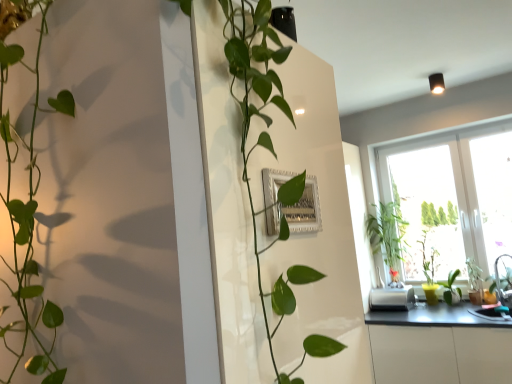
The image size is (512, 384). What do you see at coordinates (452, 196) in the screenshot? I see `transparent glass window at right` at bounding box center [452, 196].

Describe the element at coordinates (392, 299) in the screenshot. I see `white plastic toaster at lower right` at that location.

What do you see at coordinates (298, 212) in the screenshot?
I see `silver/glossy picture frame at center` at bounding box center [298, 212].

This screenshot has width=512, height=384. Describe the element at coordinates (498, 291) in the screenshot. I see `matte black sink at lower right` at that location.

I want to click on green glossy plant at right, arranged as the 2th houseplant when viewed from the front, so click(387, 236).

What do you see at coordinates (451, 288) in the screenshot? The height and width of the screenshot is (384, 512). I see `green glossy plant at right, the 2th plant viewed from the right` at bounding box center [451, 288].

The height and width of the screenshot is (384, 512). What are the coordinates of `transparent glass window at right` in the screenshot? It's located at (452, 196).

Which is correct: silver/glossy picture frame at center is inside white plastic toaster at lower right, or outside of it?

silver/glossy picture frame at center is located beyond the bounds of white plastic toaster at lower right.

Is point (311, 199) in front of point (390, 310)?

That is True.

In the image, is silver/glossy picture frame at center on the left side or the right side of white plastic toaster at lower right?

Clearly, silver/glossy picture frame at center is on the left of white plastic toaster at lower right in the image.

Between transparent glass window at right and metallic gray countertop at lower right, which one has larger width?

Wider between the two is metallic gray countertop at lower right.

Is transparent glass window at right far from metallic gray countertop at lower right?

No, transparent glass window at right is not far away from metallic gray countertop at lower right.

Does transparent glass window at right have a lesser height compared to metallic gray countertop at lower right?

No.

You are a GUI agent. You are given a task and a screenshot of the screen. Output one action in this format:
    pyautogui.click(x=<x>, y=<y>)
    Task: Click on the counter top below the transparent glass window at right (from the image's perspective)
    This screenshot has height=384, width=512.
    Given the screenshot: What is the action you would take?
    pyautogui.click(x=439, y=346)

From the image's perspective, is silver/glossy picture frame at center located beneath matte black sink at lower right?

Incorrect, from the image's perspective, silver/glossy picture frame at center is higher than matte black sink at lower right.

From a real-world perspective, is silver/glossy picture frame at center beneath matte black sink at lower right?

No, from a real-world perspective, silver/glossy picture frame at center is not below matte black sink at lower right.

Is point (303, 227) closer or farther from the camera than point (489, 279)?

Clearly, point (303, 227) is closer to the camera than point (489, 279).

Does silver/glossy picture frame at center have a lesser height compared to matte black sink at lower right?

Yes, silver/glossy picture frame at center is shorter than matte black sink at lower right.

Does green glossy plant at right, positioned as the first houseplant in right-to-left order, have a greater width compared to metallic gray countertop at lower right?

Incorrect, the width of green glossy plant at right, positioned as the first houseplant in right-to-left order, does not surpass that of metallic gray countertop at lower right.

Would you say green glossy plant at right, arranged as the 2th houseplant when viewed from the front, is to the left or to the right of metallic gray countertop at lower right in the picture?

Based on their positions, green glossy plant at right, arranged as the 2th houseplant when viewed from the front, is located to the left of metallic gray countertop at lower right.

Could you tell me if green glossy plant at right, the 1th houseplant in the back-to-front sequence, is facing metallic gray countertop at lower right?

No, green glossy plant at right, the 1th houseplant in the back-to-front sequence, is not facing towards metallic gray countertop at lower right.

From the image's perspective, which one is positioned higher, green glossy plant at right, arranged as the 2th houseplant when viewed from the front, or metallic gray countertop at lower right?

green glossy plant at right, arranged as the 2th houseplant when viewed from the front.

Who is more distant, white plastic toaster at lower right or green glossy plant at left, arranged as the second houseplant when viewed from the back?

white plastic toaster at lower right is further from the camera.

Identify the location of appliance behind the green glossy plant at left, arranged as the second houseplant when viewed from the back. This screenshot has width=512, height=384. (392, 299).

Is white plastic toaster at lower right spatially inside green glossy plant at left, which ranks as the 1th houseplant in left-to-right order, or outside of it?

white plastic toaster at lower right is spatially situated outside green glossy plant at left, which ranks as the 1th houseplant in left-to-right order.

In terms of height, does green glossy plant at right, positioned as the first houseplant in right-to-left order, look taller or shorter compared to silver/glossy picture frame at center?

Considering their sizes, green glossy plant at right, positioned as the first houseplant in right-to-left order, has more height than silver/glossy picture frame at center.

From the image's perspective, which one is positioned higher, green glossy plant at right, positioned as the first houseplant in right-to-left order, or silver/glossy picture frame at center?

silver/glossy picture frame at center.

How many degrees apart are the facing directions of green glossy plant at right, the second houseplant viewed from the left, and silver/glossy picture frame at center?

The angular difference between green glossy plant at right, the second houseplant viewed from the left, and silver/glossy picture frame at center is 90.3 degrees.

Can you confirm if green glossy plant at right, positioned as the first houseplant in right-to-left order, is positioned to the left of silver/glossy picture frame at center?

No.

Is transparent glass window at right inside the boundaries of green matte plant at right, which is the 1th plant in right-to-left order, or outside?

The correct answer is: outside.

Can you see transparent glass window at right touching green matte plant at right, which is the 1th plant in right-to-left order?

No, transparent glass window at right is not beside green matte plant at right, which is the 1th plant in right-to-left order.

Does transparent glass window at right have a smaller size compared to green matte plant at right, the second plant when ordered from left to right?

No, transparent glass window at right is not smaller than green matte plant at right, the second plant when ordered from left to right.

Is point (445, 186) closer or farther from the camera than point (470, 258)?

Point (445, 186) is farther from the camera than point (470, 258).

This screenshot has height=384, width=512. Identify the location of appliance on the right of silver/glossy picture frame at center. (392, 299).

Locate an element on the screen. The image size is (512, 384). window above the metallic gray countertop at lower right (from the image's perspective) is located at coordinates (452, 196).

Consider the image. Considering their positions, is green glossy plant at right, the 1th houseplant in the back-to-front sequence, positioned closer to green matte plant at right, which is the 1th plant in right-to-left order, than white plastic toaster at lower right?

Among the two, white plastic toaster at lower right is located nearer to green matte plant at right, which is the 1th plant in right-to-left order.

Which object lies nearer to the anchor point green matte plant at right, the second plant when ordered from left to right, green glossy plant at left, the first houseplant from the front, or green glossy plant at right, positioned as the first houseplant in right-to-left order?

Based on the image, green glossy plant at right, positioned as the first houseplant in right-to-left order, appears to be nearer to green matte plant at right, the second plant when ordered from left to right.

From the image, which object appears to be farther from matte black sink at lower right, green glossy plant at right, positioned as the first houseplant in right-to-left order, or white plastic toaster at lower right?

green glossy plant at right, positioned as the first houseplant in right-to-left order, is positioned further to the anchor matte black sink at lower right.

Which object lies nearer to the anchor point green glossy plant at left, which ranks as the 1th houseplant in left-to-right order, white plastic toaster at lower right or transparent glass window at right?

Based on the image, white plastic toaster at lower right appears to be nearer to green glossy plant at left, which ranks as the 1th houseplant in left-to-right order.

Considering their positions, is green matte plant at right, which is the 1th plant in right-to-left order, positioned further to transparent glass window at right than white plastic toaster at lower right?

white plastic toaster at lower right is further to transparent glass window at right.

Which object lies nearer to the anchor point green glossy plant at left, the first houseplant from the front, green glossy plant at right, positioned as the first houseplant in right-to-left order, or silver/glossy picture frame at center?

silver/glossy picture frame at center lies closer to green glossy plant at left, the first houseplant from the front, than the other object.

Considering their positions, is green matte plant at right, the second plant when ordered from left to right, positioned further to silver/glossy picture frame at center than green glossy plant at right, arranged as the 2th houseplant when viewed from the front?

green matte plant at right, the second plant when ordered from left to right, is further to silver/glossy picture frame at center.

Looking at the image, which one is located further to green glossy plant at left, which is the 2th houseplant from right to left, silver/glossy picture frame at center or green glossy plant at right, the 1th houseplant in the back-to-front sequence?

green glossy plant at right, the 1th houseplant in the back-to-front sequence.

Find the location of a particular element. This screenshot has width=512, height=384. plant located between green glossy plant at left, which is the 2th houseplant from right to left, and green matte plant at right, which is the 1th plant in right-to-left order, in the depth direction is located at coordinates (451, 288).

At what (x,y) coordinates should I click in order to perform the action: click on picture frame located between green glossy plant at left, which is the 2th houseplant from right to left, and green glossy plant at right, arranged as the 2th houseplant when viewed from the front, in the depth direction. Please return your answer as a coordinate pair (x, y). Looking at the image, I should click on (298, 212).

You are a GUI agent. You are given a task and a screenshot of the screen. Output one action in this format:
    pyautogui.click(x=<x>, y=<y>)
    Task: Click on the counter top positioned between green glossy plant at left, the first houseplant from the front, and white plastic toaster at lower right from near to far
    
    Given the screenshot: What is the action you would take?
    pyautogui.click(x=439, y=346)

Locate an element on the screen. This screenshot has height=384, width=512. window located between silver/glossy picture frame at center and green glossy plant at right, arranged as the 2th houseplant when viewed from the front, in the depth direction is located at coordinates (452, 196).